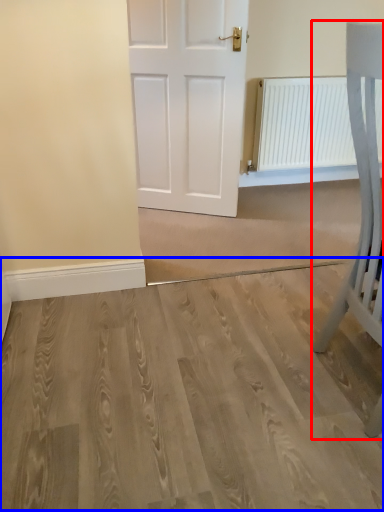
Question: Among these objects, which one is farthest to the camera, furniture (highlighted by a red box) or plain (highlighted by a blue box)?

Choices:
 (A) furniture
 (B) plain

Answer: (B)